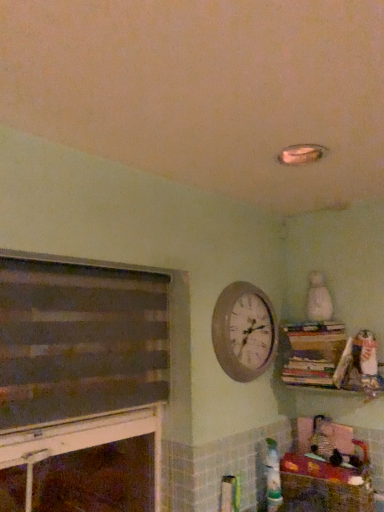
Question: Is dark gray matte fireplace at left bigger than wooden wall clock at upper center?

Choices:
 (A) yes
 (B) no

Answer: (A)

Question: Considering the relative positions of dark gray matte fireplace at left and wooden wall clock at upper center in the image provided, is dark gray matte fireplace at left to the left of wooden wall clock at upper center from the viewer's perspective?

Choices:
 (A) yes
 (B) no

Answer: (A)

Question: Is dark gray matte fireplace at left not near wooden wall clock at upper center?

Choices:
 (A) no
 (B) yes

Answer: (A)

Question: Can you confirm if dark gray matte fireplace at left is taller than wooden wall clock at upper center?

Choices:
 (A) no
 (B) yes

Answer: (B)

Question: Does dark gray matte fireplace at left come in front of wooden wall clock at upper center?

Choices:
 (A) no
 (B) yes

Answer: (B)

Question: Is dark gray matte fireplace at left wider than wooden wall clock at upper center?

Choices:
 (A) yes
 (B) no

Answer: (A)

Question: Is wooden crate at lower right positioned in front of white plush bear at upper right?

Choices:
 (A) yes
 (B) no

Answer: (A)

Question: Is white plush bear at upper right at the back of wooden crate at lower right?

Choices:
 (A) yes
 (B) no

Answer: (B)

Question: Is wooden crate at lower right further to camera compared to white plush bear at upper right?

Choices:
 (A) no
 (B) yes

Answer: (A)

Question: From the image's perspective, would you say wooden crate at lower right is positioned over white plush bear at upper right?

Choices:
 (A) no
 (B) yes

Answer: (A)

Question: Does wooden crate at lower right have a lesser width compared to white plush bear at upper right?

Choices:
 (A) yes
 (B) no

Answer: (B)

Question: Is wooden crate at lower right bigger than white plush bear at upper right?

Choices:
 (A) no
 (B) yes

Answer: (B)

Question: Is white plush bear at upper right positioned far away from wooden wall clock at upper center?

Choices:
 (A) no
 (B) yes

Answer: (A)